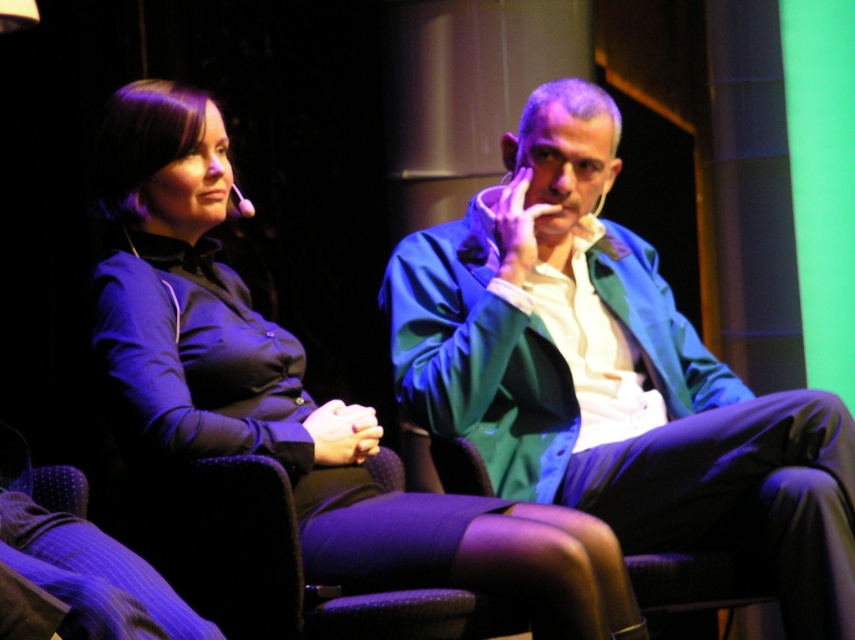
Question: Does matte green blazer at center have a larger size compared to matte black dress at center?

Choices:
 (A) yes
 (B) no

Answer: (A)

Question: Which of the following is the closest to the observer?

Choices:
 (A) matte green blazer at center
 (B) matte black dress at center

Answer: (B)

Question: Observing the image, what is the correct spatial positioning of matte green blazer at center in reference to matte black dress at center?

Choices:
 (A) right
 (B) left

Answer: (A)

Question: Which of the following is the farthest from the observer?

Choices:
 (A) (310, 554)
 (B) (706, 420)

Answer: (B)

Question: Is matte green blazer at center positioned before matte black dress at center?

Choices:
 (A) yes
 (B) no

Answer: (B)